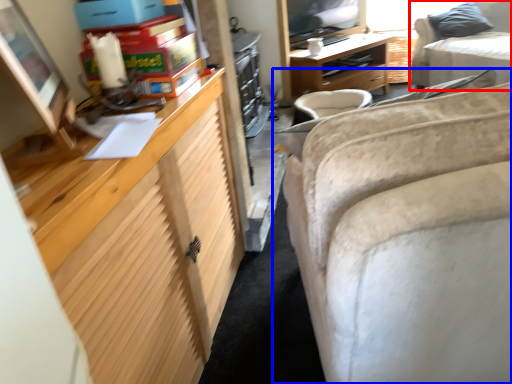
Question: Which object is closer to the camera taking this photo, studio couch (highlighted by a red box) or studio couch (highlighted by a blue box)?

Choices:
 (A) studio couch
 (B) studio couch

Answer: (B)